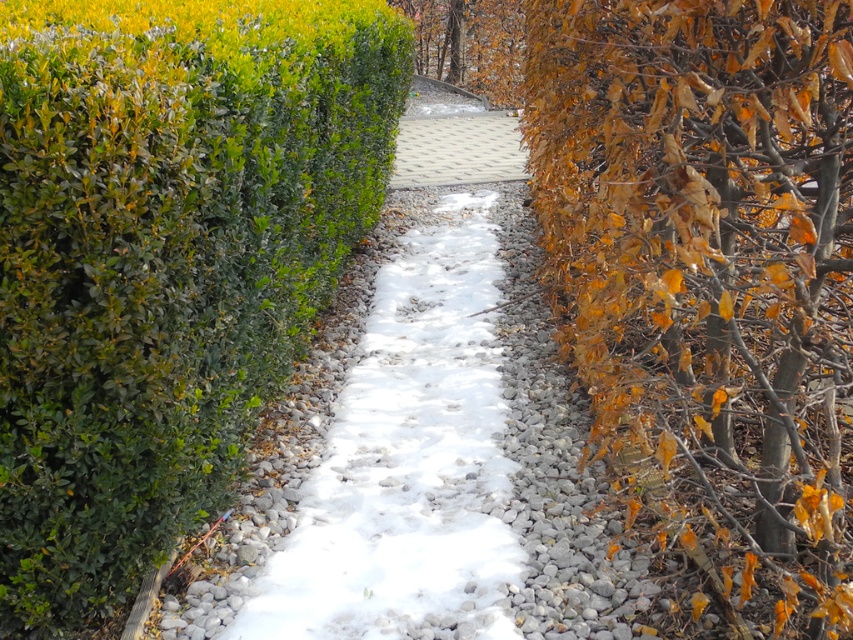
Question: Which object appears farthest from the camera in this image?

Choices:
 (A) yellow-orange leafy tree at right
 (B) green leafy bush at upper left

Answer: (B)

Question: Does yellow-orange leafy tree at right appear on the right side of brown leafy tree at upper center?

Choices:
 (A) yes
 (B) no

Answer: (A)

Question: Which object appears closest to the camera in this image?

Choices:
 (A) pebble gray paving at center
 (B) green leafy bush at upper left
 (C) brown leafy tree at upper center
 (D) yellow-orange leafy tree at right

Answer: (D)

Question: Which is nearer to the brown leafy tree at upper center?

Choices:
 (A) yellow-orange leafy tree at right
 (B) green leafy bush at upper left

Answer: (B)

Question: Is yellow-orange leafy tree at right in front of pebble gray paving at center?

Choices:
 (A) yes
 (B) no

Answer: (A)

Question: Is brown leafy tree at upper center further to the viewer compared to pebble gray paving at center?

Choices:
 (A) no
 (B) yes

Answer: (B)